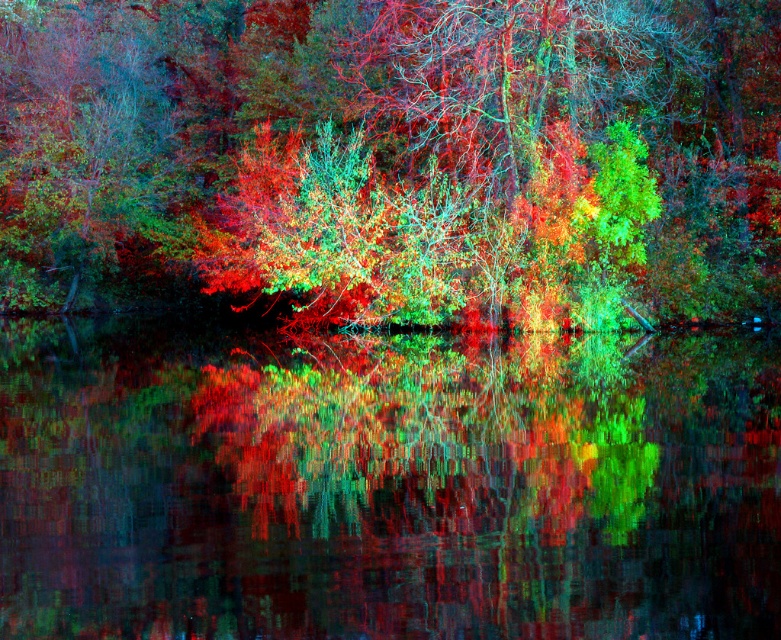
Question: Which point is closer to the camera?

Choices:
 (A) (54, 145)
 (B) (152, 570)

Answer: (B)

Question: Is multicolored foliage at center below reflective glass water at center?

Choices:
 (A) yes
 (B) no

Answer: (B)

Question: Does multicolored foliage at center appear over reflective glass water at center?

Choices:
 (A) no
 (B) yes

Answer: (B)

Question: Can you confirm if multicolored foliage at center is positioned to the right of reflective glass water at center?

Choices:
 (A) no
 (B) yes

Answer: (A)

Question: Among these objects, which one is nearest to the camera?

Choices:
 (A) reflective glass water at center
 (B) multicolored foliage at center

Answer: (A)

Question: Which point is closer to the camera?

Choices:
 (A) (515, 252)
 (B) (444, 364)

Answer: (B)